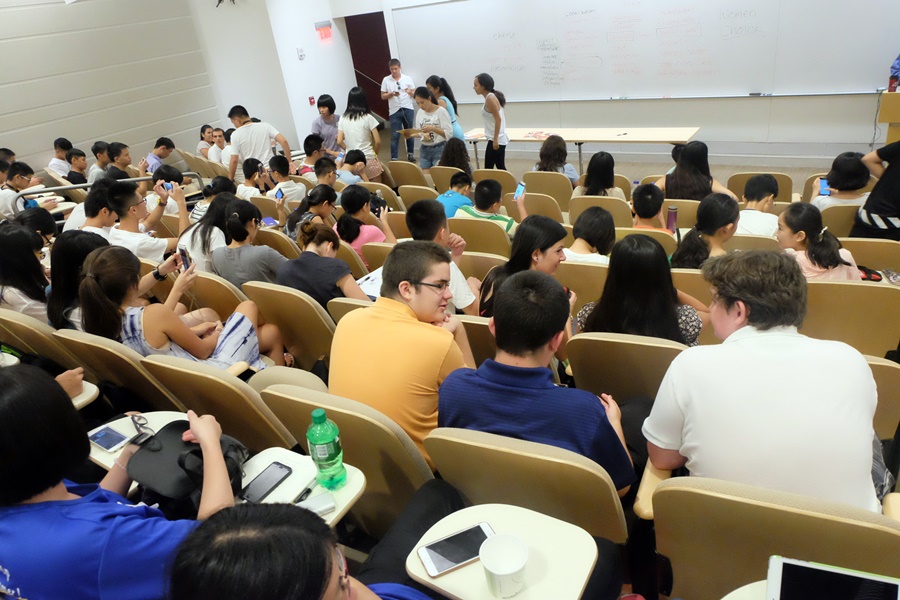
Identify the location of instructor table. Image resolution: width=900 pixels, height=600 pixels. (645, 138).